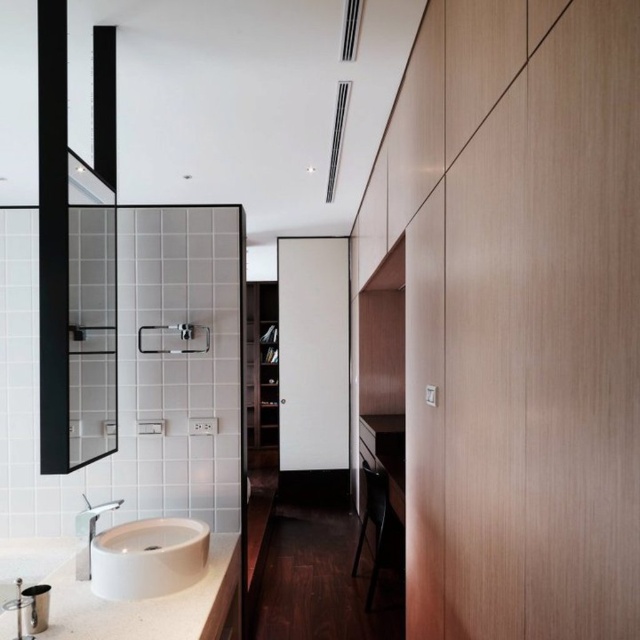
Is black glass mirror at upper left wider than white matte countertop at lower left?

No.

Does black glass mirror at upper left appear under white matte countertop at lower left?

Incorrect, black glass mirror at upper left is not positioned below white matte countertop at lower left.

Which is behind, point (93, 422) or point (202, 604)?

The point (93, 422) is behind.

At what (x,y) coordinates should I click in order to perform the action: click on black glass mirror at upper left. Please return your answer as a coordinate pair (x, y). Image resolution: width=640 pixels, height=640 pixels. Looking at the image, I should click on (93, 268).

Based on the photo, can you confirm if black glass mirror at upper left is smaller than white glossy sink at lower left?

No.

Who is lower down, black glass mirror at upper left or white glossy sink at lower left?

white glossy sink at lower left is below.

Where is `black glass mirror at upper left`? This screenshot has height=640, width=640. black glass mirror at upper left is located at coordinates (93, 268).

You are a GUI agent. You are given a task and a screenshot of the screen. Output one action in this format:
    pyautogui.click(x=<x>, y=<y>)
    Task: Click on the black glass mirror at upper left
    
    Given the screenshot: What is the action you would take?
    pyautogui.click(x=93, y=268)

Is point (177, 522) closer to camera compared to point (86, 538)?

That is False.

Between white glossy sink at lower left and matte silver faucet at lower left, which one has less height?

matte silver faucet at lower left is shorter.

Who is more distant from viewer, [131,557] or [100,508]?

Point [100,508]

Where is `white glossy sink at lower left`? The image size is (640, 640). white glossy sink at lower left is located at coordinates (148, 557).